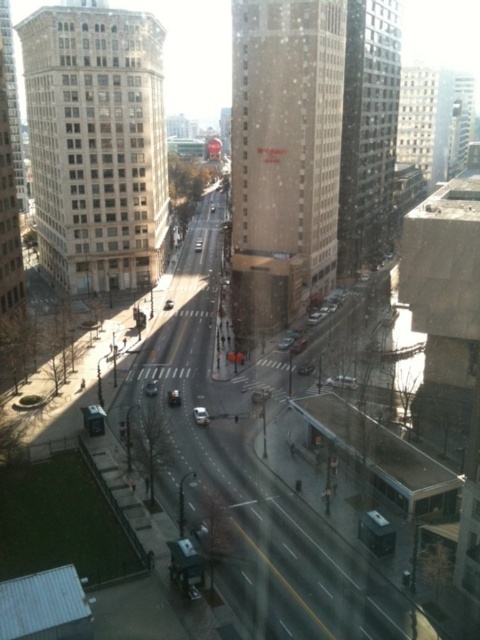
Question: Which point appears closest to the camera in this image?

Choices:
 (A) (155, 388)
 (B) (195, 416)

Answer: (B)

Question: Is silver metallic sedan at center thinner than silver metallic car at center?

Choices:
 (A) no
 (B) yes

Answer: (A)

Question: Does silver metallic sedan at center have a smaller size compared to silver metallic car at center?

Choices:
 (A) yes
 (B) no

Answer: (B)

Question: Is silver metallic sedan at center wider than silver metallic car at center?

Choices:
 (A) no
 (B) yes

Answer: (B)

Question: Which point is closer to the camera?

Choices:
 (A) (207, 413)
 (B) (145, 388)

Answer: (A)